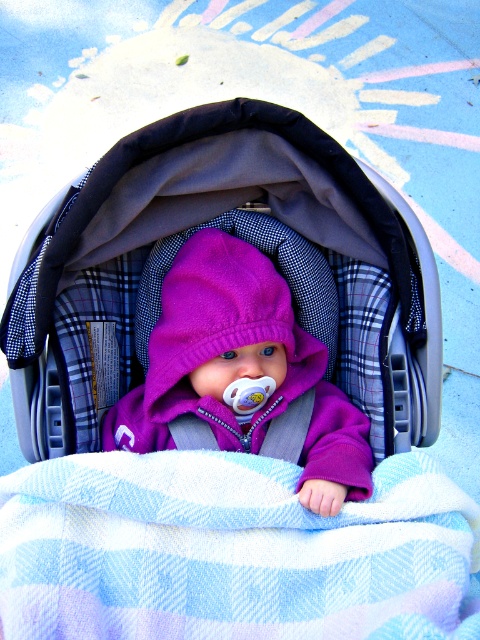
Is blue striped blanket at center to the right of plaid fabric baby carriage at center from the viewer's perspective?

Indeed, blue striped blanket at center is positioned on the right side of plaid fabric baby carriage at center.

Between blue striped blanket at center and plaid fabric baby carriage at center, which one has less height?

blue striped blanket at center

Which is in front, point (269, 605) or point (75, 448)?

Point (269, 605)

Locate an element on the screen. Image resolution: width=480 pixels, height=640 pixels. blue striped blanket at center is located at coordinates (228, 550).

Who is shorter, plaid fabric baby carriage at center or purple fleece baby at center?

With less height is purple fleece baby at center.

Is point (360, 358) more distant than point (247, 340)?

Yes, it is behind point (247, 340).

The image size is (480, 640). What are the coordinates of `plaid fabric baby carriage at center` in the screenshot? It's located at (199, 227).

What do you see at coordinates (228, 550) in the screenshot? Image resolution: width=480 pixels, height=640 pixels. I see `blue striped blanket at center` at bounding box center [228, 550].

At what (x,y) coordinates should I click in order to perform the action: click on blue striped blanket at center. Please return your answer as a coordinate pair (x, y). Image resolution: width=480 pixels, height=640 pixels. Looking at the image, I should click on (228, 550).

Image resolution: width=480 pixels, height=640 pixels. Identify the location of blue striped blanket at center. (228, 550).